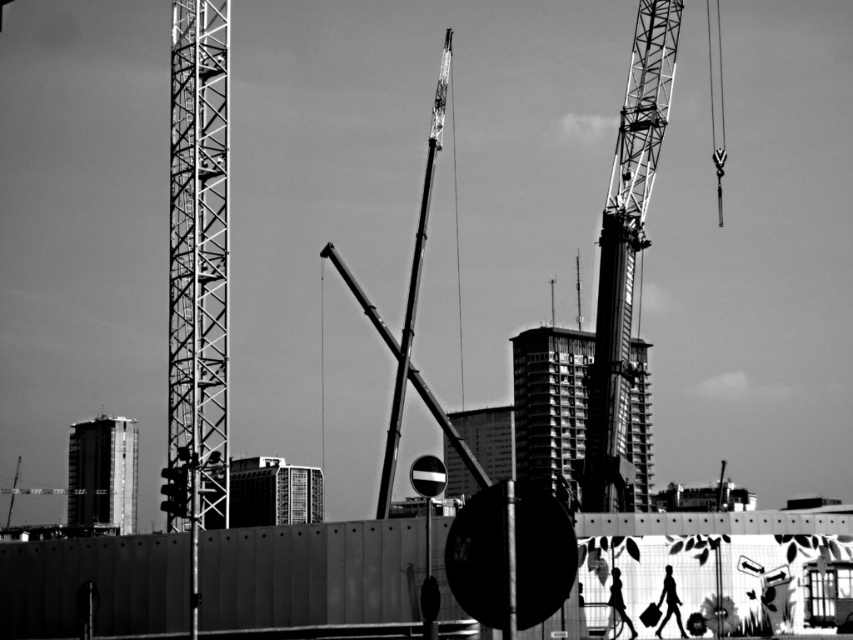
Question: Can you confirm if metallic construction crane at center is thinner than smooth concrete building at center?

Choices:
 (A) yes
 (B) no

Answer: (A)

Question: Can you confirm if metallic industrial crane at center is thinner than smooth glass building at center?

Choices:
 (A) no
 (B) yes

Answer: (A)

Question: Which object appears closest to the camera in this image?

Choices:
 (A) smooth glass building at center
 (B) metallic construction crane at center

Answer: (B)

Question: Can you confirm if metallic lattice tower at left is smaller than metallic industrial crane at center?

Choices:
 (A) yes
 (B) no

Answer: (A)

Question: Among these objects, which one is nearest to the camera?

Choices:
 (A) metallic construction crane at center
 (B) smooth glass tower at lower left
 (C) smooth glass building at center

Answer: (A)

Question: Among these points, which one is nearest to the camera?

Choices:
 (A) (583, 428)
 (B) (244, 500)
 (C) (206, 161)

Answer: (C)